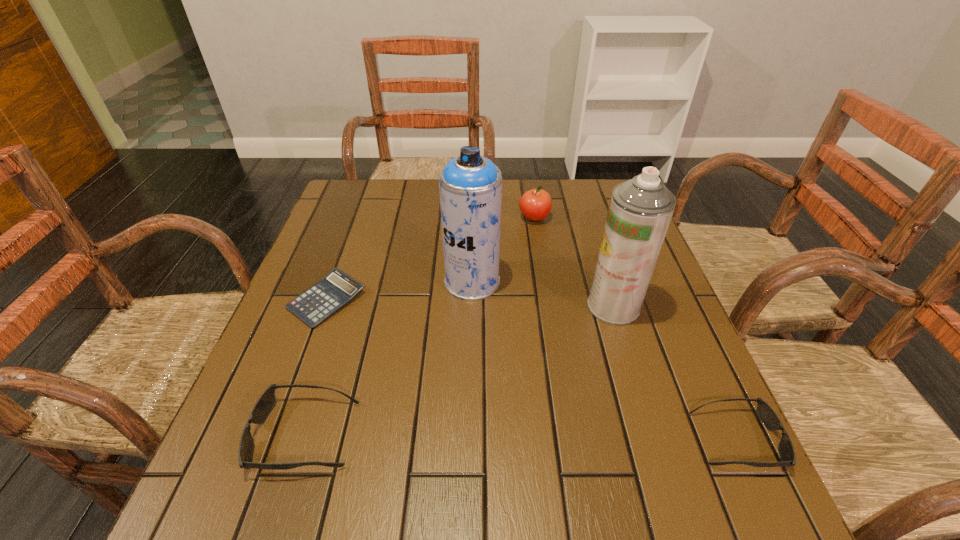
What are the coordinates of `the third shortest object` in the screenshot? It's located at (266, 402).

The image size is (960, 540). I want to click on the left sunglasses, so click(266, 402).

At what (x,y) coordinates should I click in order to perform the action: click on the right sunglasses. Please return your answer as a coordinate pair (x, y). The image size is (960, 540). Looking at the image, I should click on (765, 413).

Find the location of a particular element. the second shortest object is located at coordinates (765, 413).

Where is `calculator`? calculator is located at coordinates (336, 289).

Locate an element on the screen. Image resolution: width=960 pixels, height=540 pixels. the farthest object is located at coordinates (535, 205).

Find the location of a particular element. Image resolution: width=960 pixels, height=540 pixels. the third object from right to left is located at coordinates (535, 205).

The height and width of the screenshot is (540, 960). Find the location of `the fifth object from left to right`. the fifth object from left to right is located at coordinates (640, 210).

Find the location of a particular element. Image resolution: width=960 pixels, height=540 pixels. the left aerosol can is located at coordinates (470, 186).

The height and width of the screenshot is (540, 960). I want to click on vacant space positioned 0.110m on the front of the calculator, so click(x=301, y=371).